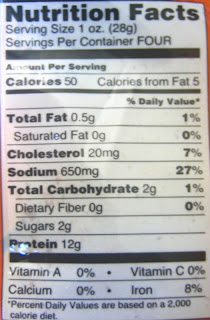
You are a GUI agent. You are given a task and a screenshot of the screen. Output one action in this format:
    pyautogui.click(x=<x>, y=<y>)
    Task: Click on the iron
    
    Given the screenshot: What is the action you would take?
    pyautogui.click(x=143, y=292)